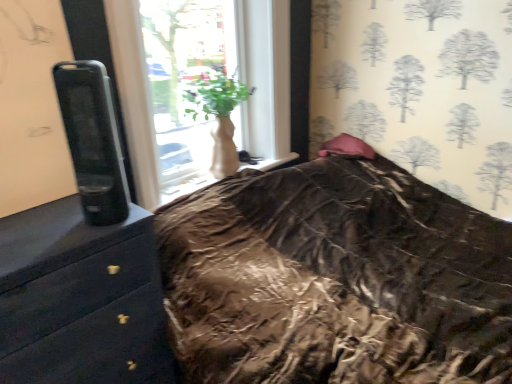
Question: Does white matte vase at center turn towards pink satin pillow at upper right?

Choices:
 (A) yes
 (B) no

Answer: (B)

Question: Is white matte vase at center bigger than pink satin pillow at upper right?

Choices:
 (A) no
 (B) yes

Answer: (B)

Question: Can you confirm if white matte vase at center is positioned to the right of pink satin pillow at upper right?

Choices:
 (A) yes
 (B) no

Answer: (B)

Question: Considering the relative sizes of white matte vase at center and pink satin pillow at upper right in the image provided, is white matte vase at center thinner than pink satin pillow at upper right?

Choices:
 (A) yes
 (B) no

Answer: (B)

Question: From a real-world perspective, is white matte vase at center positioned over pink satin pillow at upper right based on gravity?

Choices:
 (A) yes
 (B) no

Answer: (A)

Question: Based on their sizes in the image, would you say black glossy chest of drawers at left is bigger or smaller than white matte vase at center?

Choices:
 (A) small
 (B) big

Answer: (B)

Question: Is black glossy chest of drawers at left in front of or behind white matte vase at center in the image?

Choices:
 (A) behind
 (B) front

Answer: (B)

Question: In terms of height, does black glossy chest of drawers at left look taller or shorter compared to white matte vase at center?

Choices:
 (A) tall
 (B) short

Answer: (A)

Question: From a real-world perspective, is black glossy chest of drawers at left above or below white matte vase at center?

Choices:
 (A) above
 (B) below

Answer: (B)

Question: Do you think white matte vase at center is within black glossy chest of drawers at left, or outside of it?

Choices:
 (A) outside
 (B) inside

Answer: (A)

Question: Considering the positions of point (218, 157) and point (7, 235), is point (218, 157) closer or farther from the camera than point (7, 235)?

Choices:
 (A) closer
 (B) farther

Answer: (B)

Question: From a real-world perspective, is white matte vase at center positioned above or below black glossy chest of drawers at left?

Choices:
 (A) above
 (B) below

Answer: (A)

Question: In terms of height, does white matte vase at center look taller or shorter compared to black glossy chest of drawers at left?

Choices:
 (A) tall
 (B) short

Answer: (B)

Question: From the image's perspective, relative to pink satin pillow at upper right, is white matte vase at center above or below?

Choices:
 (A) above
 (B) below

Answer: (A)

Question: In terms of size, does white matte vase at center appear bigger or smaller than pink satin pillow at upper right?

Choices:
 (A) big
 (B) small

Answer: (A)